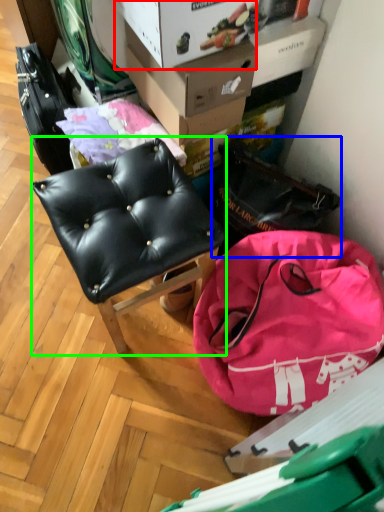
Question: Which object is positioned closest to cardboard box (highlighted by a red box)? Select from messenger bag (highlighted by a blue box) and chair (highlighted by a green box).

Choices:
 (A) messenger bag
 (B) chair

Answer: (B)